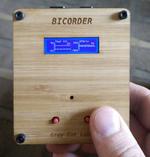
What are the coordinates of `screen` in the screenshot? It's located at (53, 48).